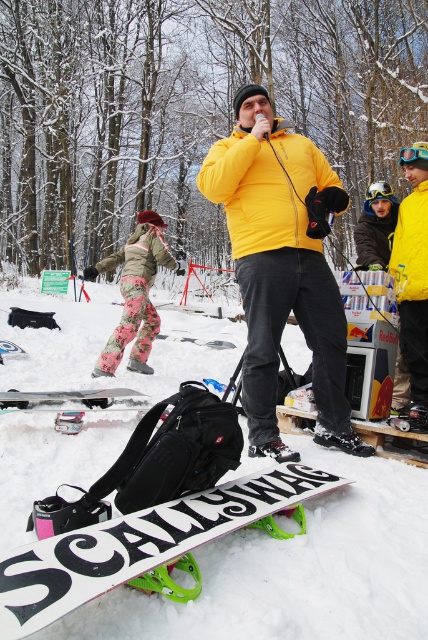
Which is behind, point (341, 577) or point (36, 396)?

Point (36, 396)

Can you confirm if white matte snowboard at center is taller than white matte snowboard at lower left?

Indeed, white matte snowboard at center has a greater height compared to white matte snowboard at lower left.

Measure the distance between white matte snowboard at center and camera.

white matte snowboard at center is 1.50 meters from camera.

Image resolution: width=428 pixels, height=640 pixels. In order to click on white matte snowboard at center in this screenshot , I will do `click(297, 570)`.

Is white matte snowboard at lower center bigger than floral-patterned pants at left?

Actually, white matte snowboard at lower center might be smaller than floral-patterned pants at left.

Who is higher up, white matte snowboard at lower center or floral-patterned pants at left?

floral-patterned pants at left

Image resolution: width=428 pixels, height=640 pixels. Find the location of `white matte snowboard at lower center`. white matte snowboard at lower center is located at coordinates (139, 544).

Where is `white matte snowboard at center`? The image size is (428, 640). white matte snowboard at center is located at coordinates (297, 570).

How far apart are white matte snowboard at center and white matte snowboard at lower center?

A distance of 1.72 meters exists between white matte snowboard at center and white matte snowboard at lower center.

Who is more distant from viewer, (83, 440) or (211, 512)?

Point (83, 440)

Locate an element on the screen. The width and height of the screenshot is (428, 640). white matte snowboard at center is located at coordinates (297, 570).